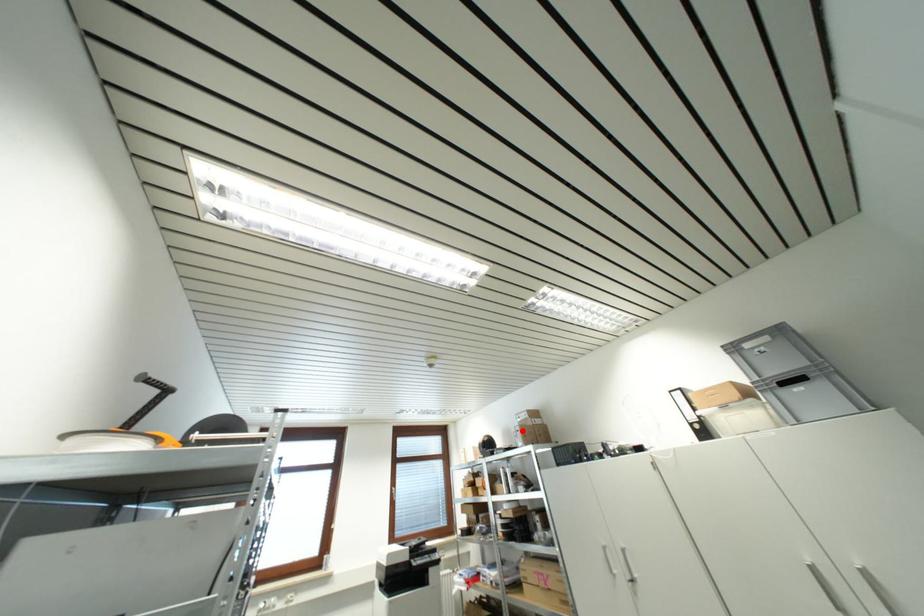
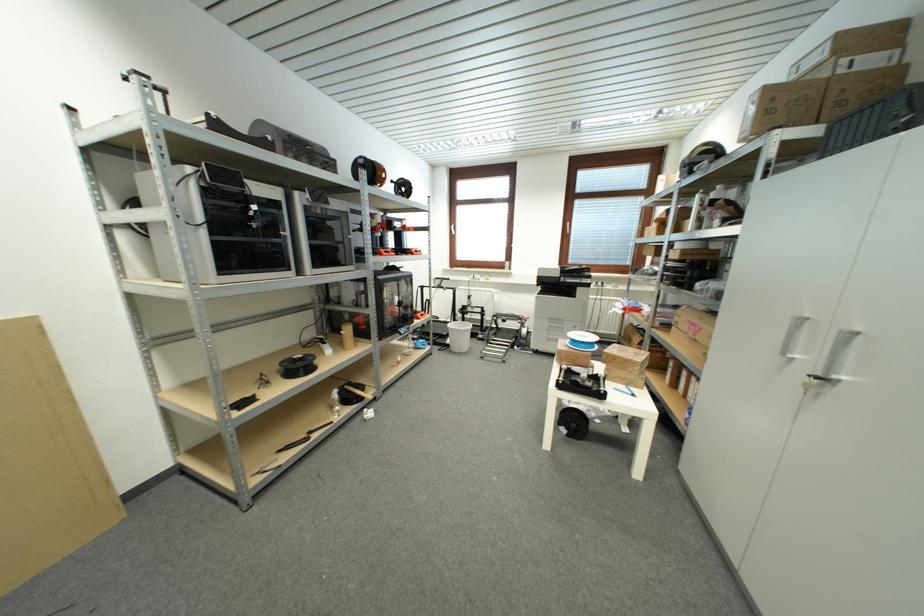
Question: I am providing you with two images of the same scene from different viewpoints. Given a red point in image1, look at the same physical point in image2. Is it:

Choices:
 (A) Closer to the viewpoint
 (B) Farther from the viewpoint

Answer: (A)